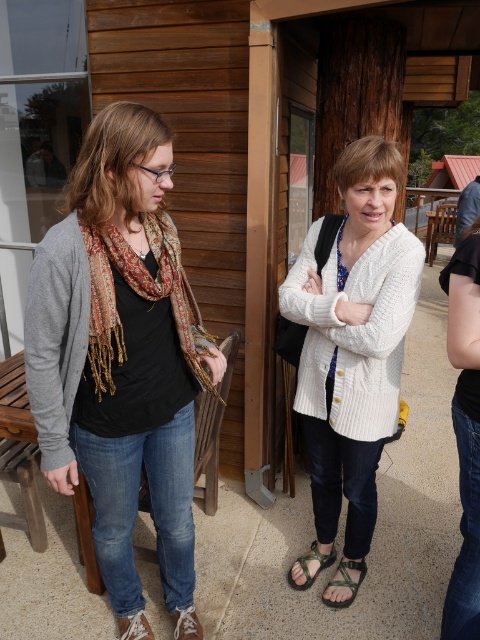
Can you confirm if matte black scarf at left is bigger than white knitted cardigan at center?

Yes.

Does matte black scarf at left come in front of white knitted cardigan at center?

Yes, it is in front of white knitted cardigan at center.

Identify the location of matte black scarf at left. (121, 358).

Image resolution: width=480 pixels, height=640 pixels. Identify the location of matte black scarf at left. (121, 358).

Is matte black scarf at left behind green fabric sandal at lower center?

No, matte black scarf at left is closer to the viewer.

Does point (84, 381) come farther from viewer compared to point (347, 579)?

No.

Is point (170, 426) closer to viewer compared to point (360, 582)?

Yes, point (170, 426) is in front of point (360, 582).

Identify the location of matte black scarf at left. The width and height of the screenshot is (480, 640). (121, 358).

Who is higher up, printed silk scarf at left or camouflage fabric sandal at lower center?

printed silk scarf at left is above.

Which is behind, point (105, 225) or point (328, 557)?

The point (328, 557) is more distant.

The width and height of the screenshot is (480, 640). What are the coordinates of `printed silk scarf at left` in the screenshot? It's located at (140, 296).